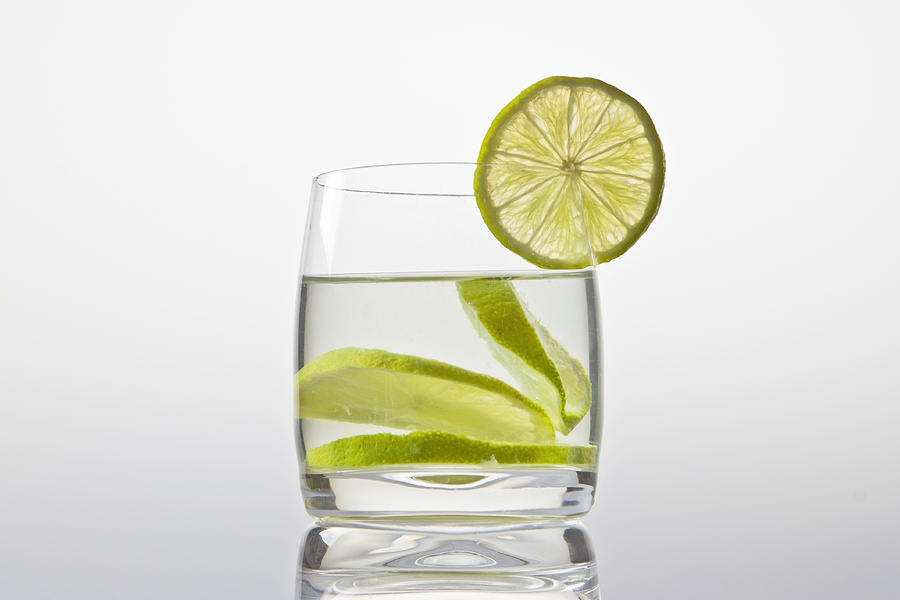
Where is `glass base`? The height and width of the screenshot is (600, 900). glass base is located at coordinates (428, 485).